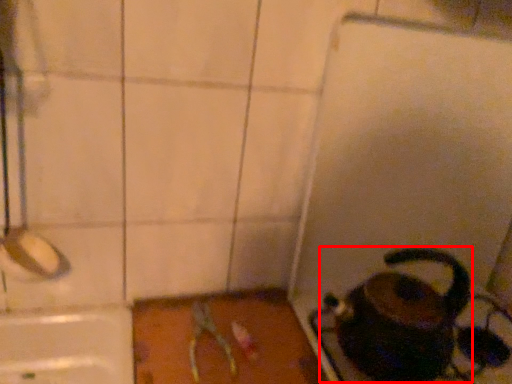
Question: From the image's perspective, where is coffeepot (annotated by the red box) located in relation to scissors in the image?

Choices:
 (A) above
 (B) below

Answer: (A)